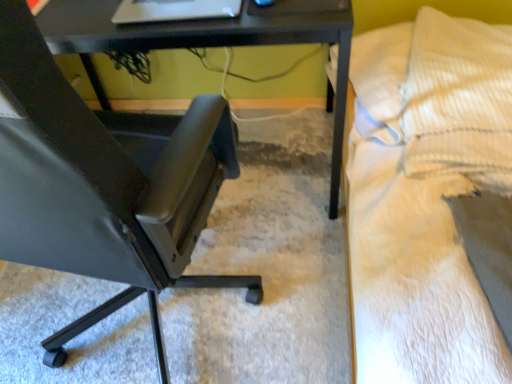
Question: From the image's perspective, is yellow corduroy pillow at upper right below white textured bed at right?

Choices:
 (A) no
 (B) yes

Answer: (A)

Question: Is yellow corduroy pillow at upper right wider than white textured bed at right?

Choices:
 (A) no
 (B) yes

Answer: (A)

Question: Is yellow corduroy pillow at upper right bigger than white textured bed at right?

Choices:
 (A) yes
 (B) no

Answer: (B)

Question: From a real-world perspective, is yellow corduroy pillow at upper right on top of white textured bed at right?

Choices:
 (A) no
 (B) yes

Answer: (B)

Question: Considering the relative positions of yellow corduroy pillow at upper right and white textured bed at right in the image provided, is yellow corduroy pillow at upper right to the left of white textured bed at right from the viewer's perspective?

Choices:
 (A) yes
 (B) no

Answer: (B)

Question: Does yellow corduroy pillow at upper right have a smaller size compared to white textured bed at right?

Choices:
 (A) yes
 (B) no

Answer: (A)

Question: From a real-world perspective, is matte black chair at left physically below white textured bed at right?

Choices:
 (A) yes
 (B) no

Answer: (B)

Question: From the image's perspective, is matte black chair at left beneath white textured bed at right?

Choices:
 (A) yes
 (B) no

Answer: (A)

Question: Is white textured bed at right located within matte black chair at left?

Choices:
 (A) yes
 (B) no

Answer: (B)

Question: From a real-world perspective, is matte black chair at left on white textured bed at right?

Choices:
 (A) yes
 (B) no

Answer: (A)

Question: Is matte black chair at left positioned with its back to white textured bed at right?

Choices:
 (A) yes
 (B) no

Answer: (B)

Question: Is matte black chair at left not close to white textured bed at right?

Choices:
 (A) no
 (B) yes

Answer: (A)

Question: Could you tell me if white textured bed at right is facing matte black chair at left?

Choices:
 (A) yes
 (B) no

Answer: (A)